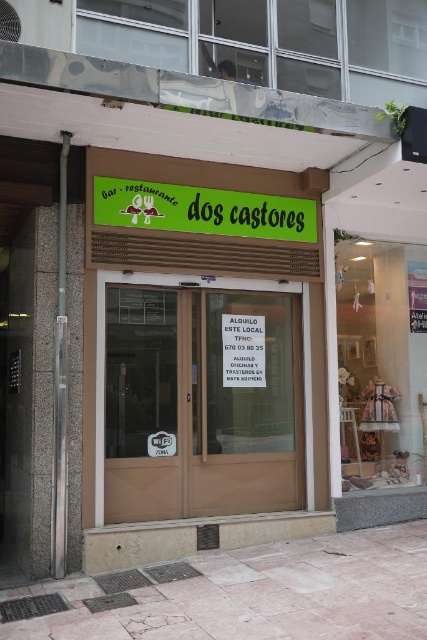
How far apart are green matte signboard at upper center and white paper sign at center?

green matte signboard at upper center is 1.05 meters away from white paper sign at center.

Is green matte signboard at upper center positioned behind white paper sign at center?

No, it is not.

Image resolution: width=427 pixels, height=640 pixels. Find the location of `green matte signboard at upper center`. green matte signboard at upper center is located at coordinates (202, 211).

Where is `green matte signboard at upper center`? The height and width of the screenshot is (640, 427). green matte signboard at upper center is located at coordinates [202, 211].

Does point (218, 484) lie behind point (225, 384)?

No, it is not.

Does brown glass door at center have a smaller size compared to white paper sign at center?

No.

Between point (248, 397) and point (237, 316), which one is positioned in front?

Point (248, 397) is more forward.

At what (x,y) coordinates should I click in order to perform the action: click on brown glass door at center. Please return your answer as a coordinate pair (x, y). This screenshot has height=640, width=427. Looking at the image, I should click on (201, 403).

Does brown glass door at center have a lesser height compared to green matte signboard at upper center?

No.

Is brown glass door at center further to camera compared to green matte signboard at upper center?

No, it is not.

Is point (272, 320) farther from viewer compared to point (104, 221)?

Yes, it is.

Where is `brown glass door at center`? This screenshot has width=427, height=640. brown glass door at center is located at coordinates (201, 403).